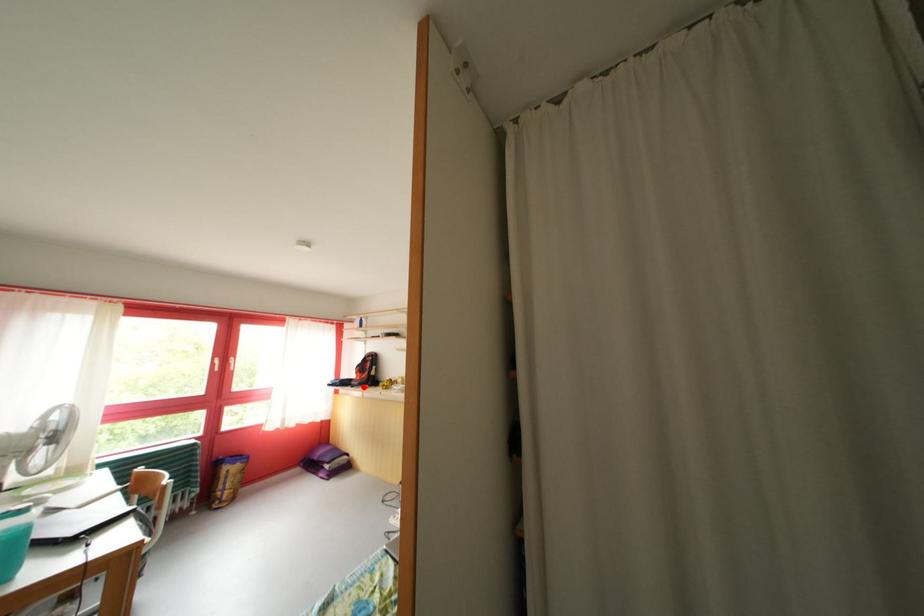
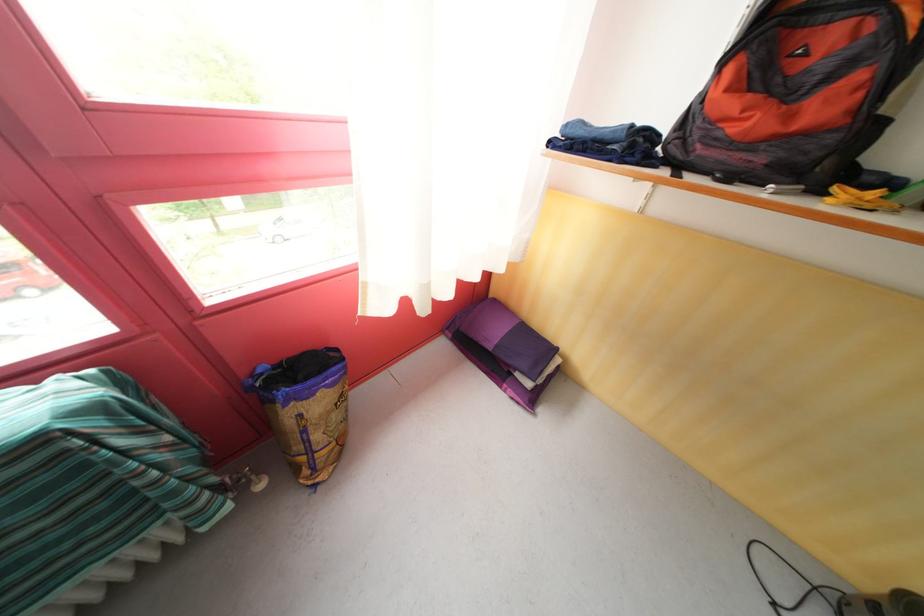
Find the pixel in the second image that matches the highlighted location in the first image.

(736, 151)